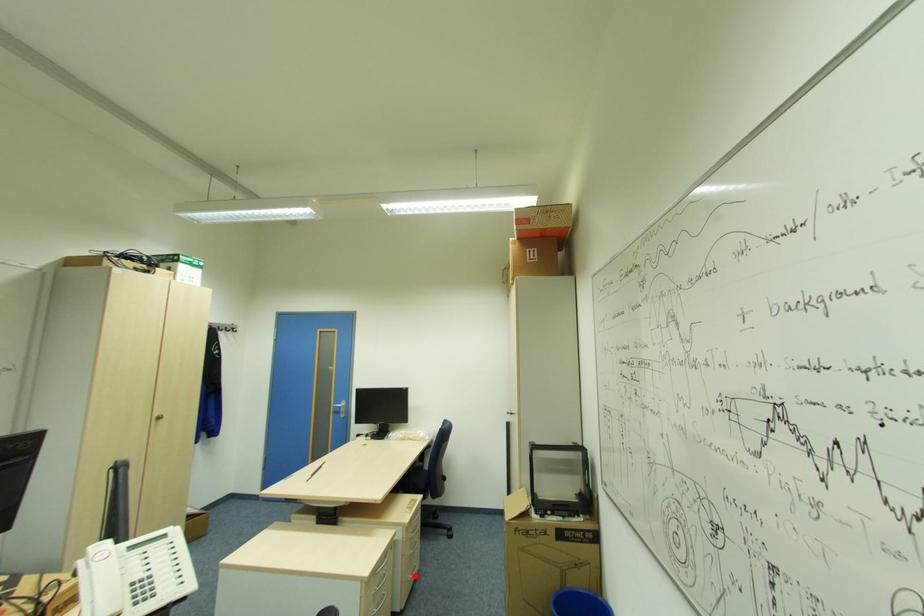
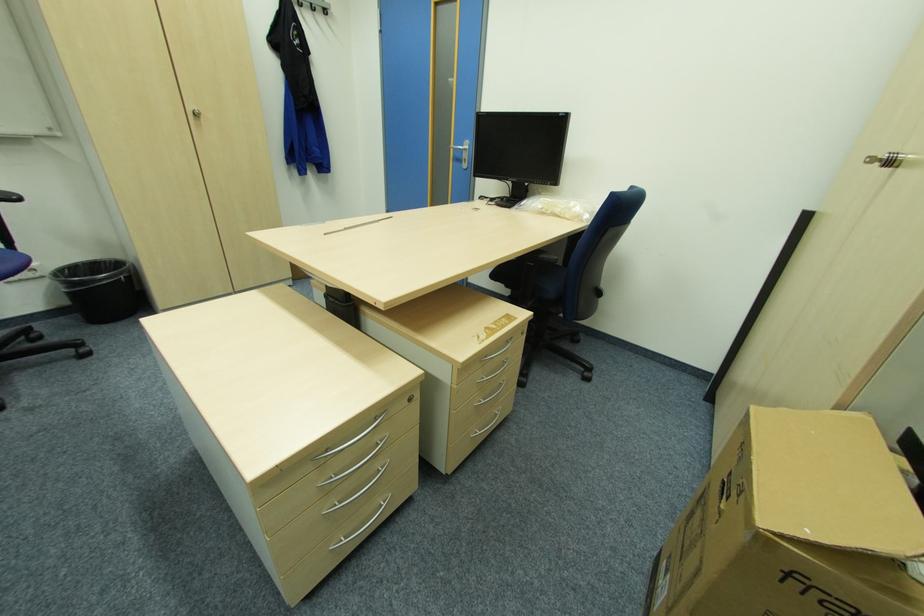
Question: I am providing you with two images of the same scene from different viewpoints. A red point is shown in image1. For the corresponding object point in image2, is it positioned nearer or farther from the camera?

Choices:
 (A) Nearer
 (B) Farther

Answer: (B)